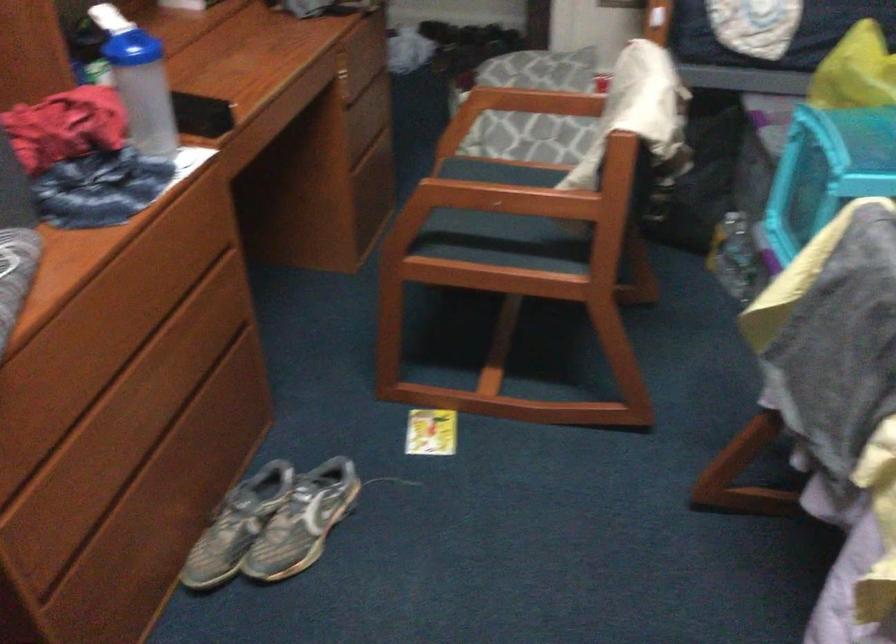
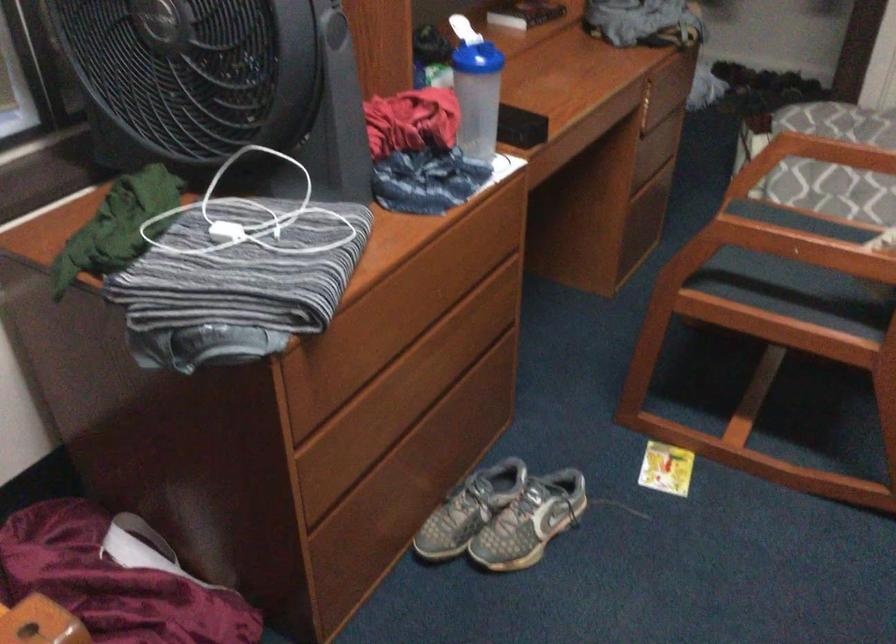
In the second image, find the point that corresponds to point 521,185 in the first image.

(826, 234)